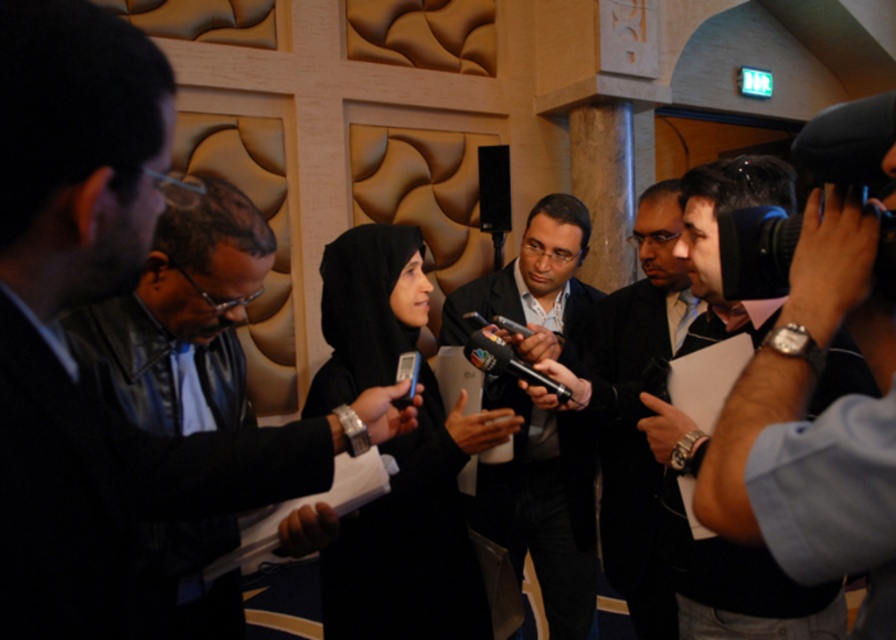
Question: Estimate the real-world distances between objects in this image. Which object is farther from the dark suit at center?

Choices:
 (A) black leather camera at right
 (B) matte black suit at center

Answer: (A)

Question: Which point appears farthest from the camera in this image?

Choices:
 (A) (67, 221)
 (B) (548, 269)
 (C) (673, 422)
 (D) (604, 337)

Answer: (B)

Question: Does black leather jacket at left have a greater width compared to black leather camera at right?

Choices:
 (A) no
 (B) yes

Answer: (A)

Question: Is black leather camera at right in front of dark suit at center?

Choices:
 (A) yes
 (B) no

Answer: (A)

Question: Is matte black suit at center to the left of dark suit at center from the viewer's perspective?

Choices:
 (A) yes
 (B) no

Answer: (A)

Question: Considering the real-world distances, which object is closest to the black leather jacket at left?

Choices:
 (A) black leather camera at right
 (B) dark suit at center
 (C) matte black suit at center

Answer: (A)